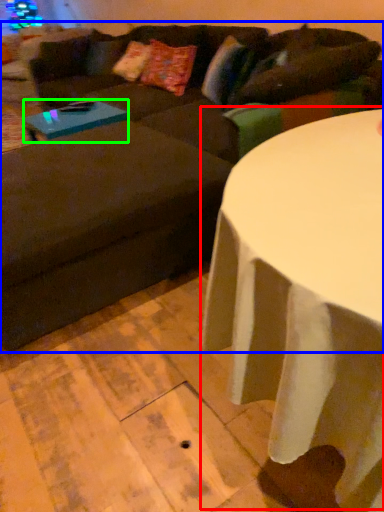
Question: Considering the real-world distances, which object is farthest from table (highlighted by a red box)? studio couch (highlighted by a blue box) or coffee table (highlighted by a green box)?

Choices:
 (A) studio couch
 (B) coffee table

Answer: (B)